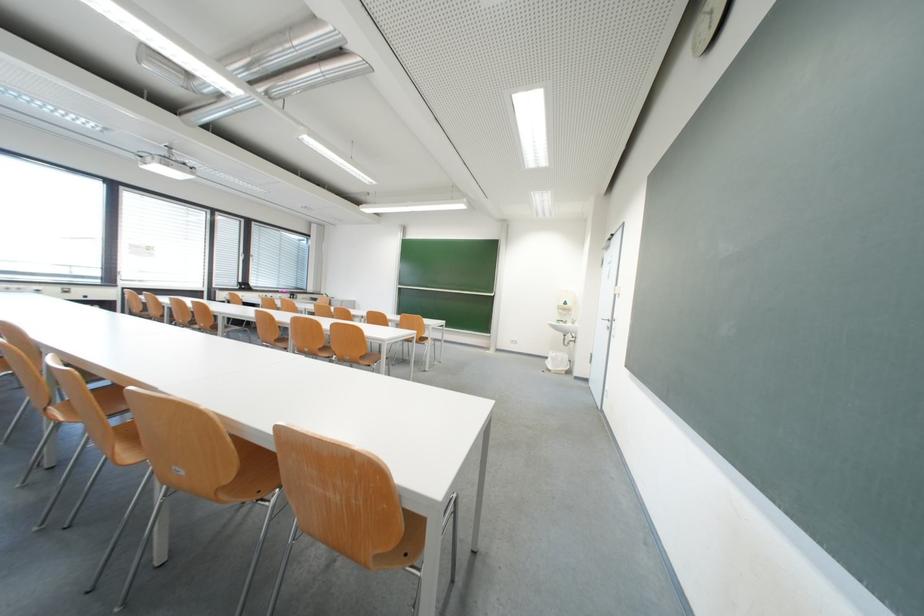
I want to click on sink faucet handle, so click(573, 336).